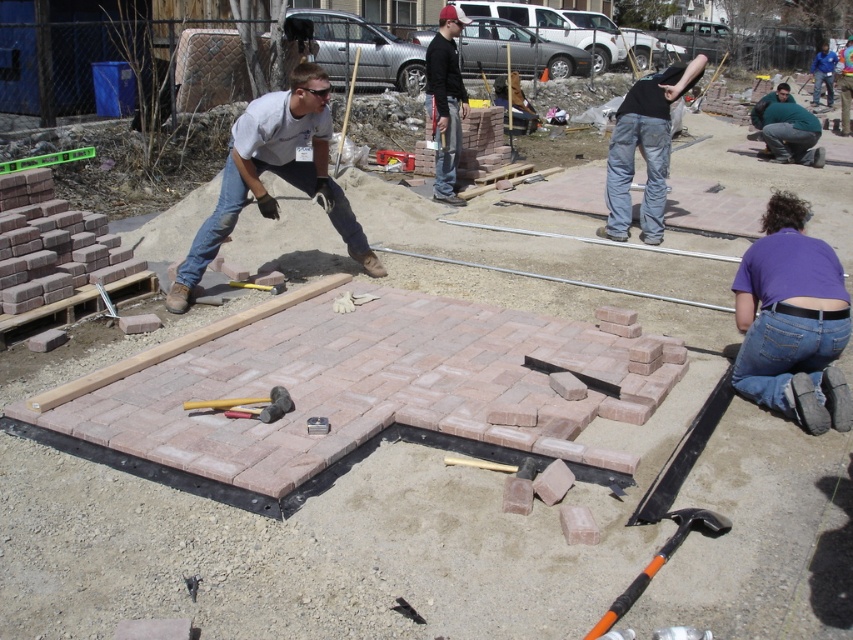
Is matte gray shirt at center below matte black shirt at upper center?

Correct, matte gray shirt at center is located below matte black shirt at upper center.

Between point (228, 188) and point (457, 10), which one is positioned in front?

Positioned in front is point (228, 188).

Does point (318, 118) come in front of point (456, 29)?

Yes, point (318, 118) is closer to viewer.

Find the location of a particular element. The width and height of the screenshot is (853, 640). matte gray shirt at center is located at coordinates (276, 173).

Is point (323, 161) less distant than point (276, 401)?

No.

Describe the element at coordinates (276, 173) in the screenshot. The height and width of the screenshot is (640, 853). I see `matte gray shirt at center` at that location.

I want to click on matte gray shirt at center, so click(276, 173).

Is fat man at lower right closer to camera compared to yellow rubber mallet at center?

No, it is not.

Can you confirm if fat man at lower right is taller than yellow rubber mallet at center?

Indeed, fat man at lower right has a greater height compared to yellow rubber mallet at center.

In order to click on fat man at lower right in this screenshot , I will do (786, 129).

You are a GUI agent. You are given a task and a screenshot of the screen. Output one action in this format:
    pyautogui.click(x=<x>, y=<y>)
    Task: Click on the fat man at lower right
    The image size is (853, 640).
    Given the screenshot: What is the action you would take?
    pyautogui.click(x=786, y=129)